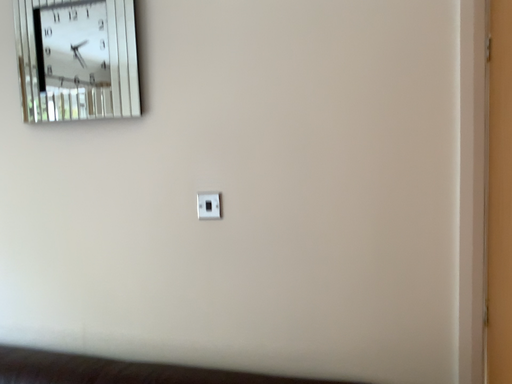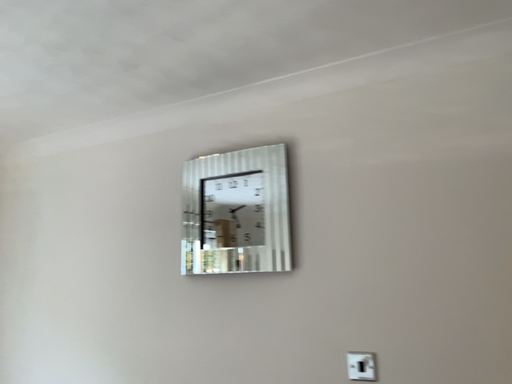
Question: Which way did the camera rotate in the video?

Choices:
 (A) rotated left
 (B) rotated right

Answer: (A)